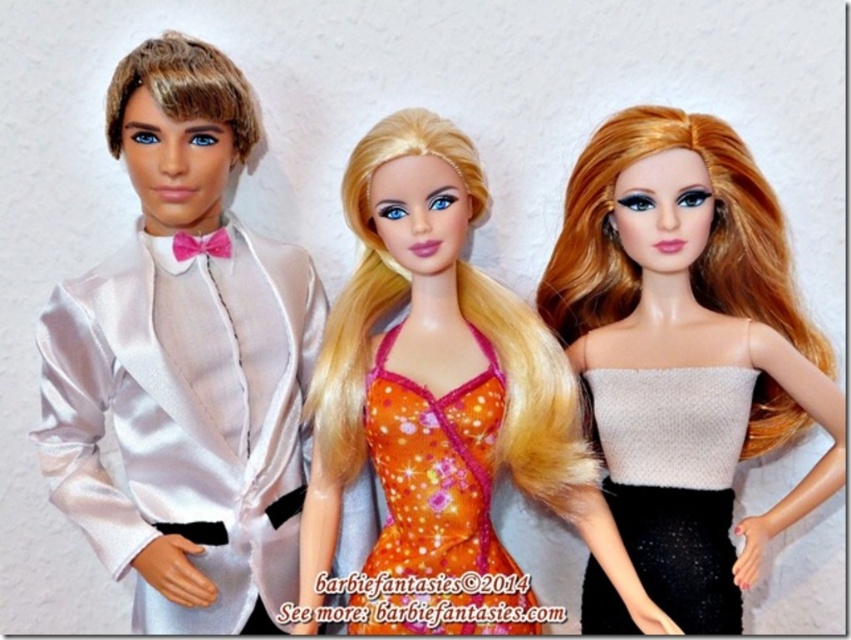
In the scene shown: How far apart are satin white tuxedo at left and white textured sweater at center?

satin white tuxedo at left is 20.91 inches away from white textured sweater at center.

I want to click on satin white tuxedo at left, so click(x=184, y=362).

This screenshot has height=640, width=851. What are the coordinates of `satin white tuxedo at left` in the screenshot? It's located at (184, 362).

Does shiny silver dress at center appear over orange satin cocktail dress at center?

Yes.

Is shiny silver dress at center wider than orange satin cocktail dress at center?

Indeed, shiny silver dress at center has a greater width compared to orange satin cocktail dress at center.

Describe the element at coordinates (690, 336) in the screenshot. I see `shiny silver dress at center` at that location.

This screenshot has height=640, width=851. What are the coordinates of `shiny silver dress at center` in the screenshot? It's located at (690, 336).

Does orange satin dress at center lie in front of shiny silver dress at center?

Yes.

What do you see at coordinates (443, 380) in the screenshot? I see `orange satin dress at center` at bounding box center [443, 380].

Find the location of a particular element. This screenshot has height=640, width=851. orange satin dress at center is located at coordinates (443, 380).